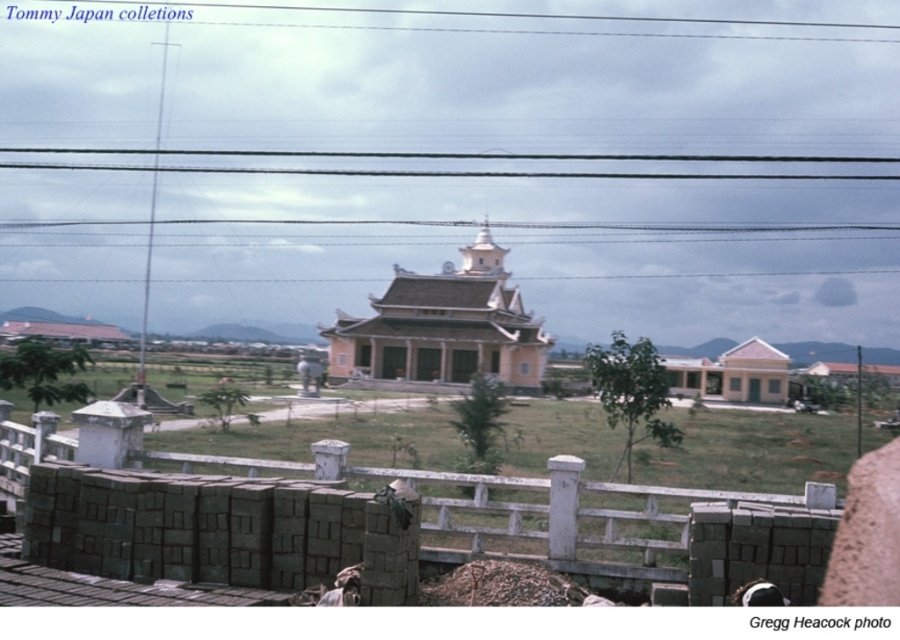
From the picture: Can you confirm if white concrete fence at lower center is wider than beige smooth temple at center?

Incorrect, white concrete fence at lower center's width does not surpass beige smooth temple at center's.

Is point (446, 532) positioned in front of point (402, 308)?

Yes, it is in front of point (402, 308).

Describe the element at coordinates (369, 516) in the screenshot. The image size is (900, 640). I see `white concrete fence at lower center` at that location.

I want to click on white concrete fence at lower center, so click(x=369, y=516).

Is beige smooth temple at center shorter than black wire at upper center?

Incorrect, beige smooth temple at center's height does not fall short of black wire at upper center's.

Consider the image. Can you confirm if beige smooth temple at center is positioned above black wire at upper center?

Incorrect, beige smooth temple at center is not positioned above black wire at upper center.

The height and width of the screenshot is (640, 900). Find the location of `beige smooth temple at center`. beige smooth temple at center is located at coordinates [x=444, y=326].

Is point (136, 508) positioned behind point (681, 176)?

That is False.

Is point (370, 582) farther from camera compared to point (189, 168)?

No, it is not.

Find the location of `white concrete fence at lower center`. white concrete fence at lower center is located at coordinates 369,516.